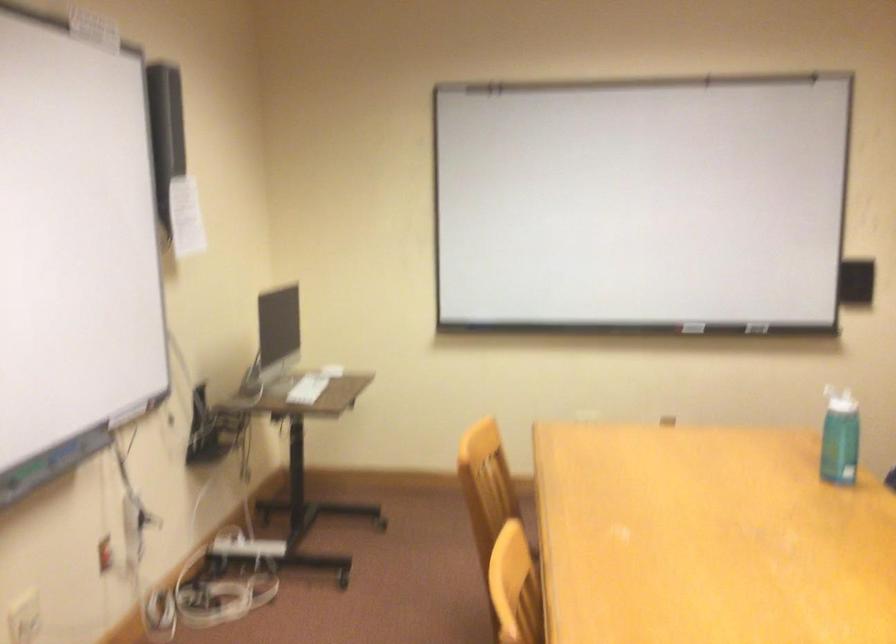
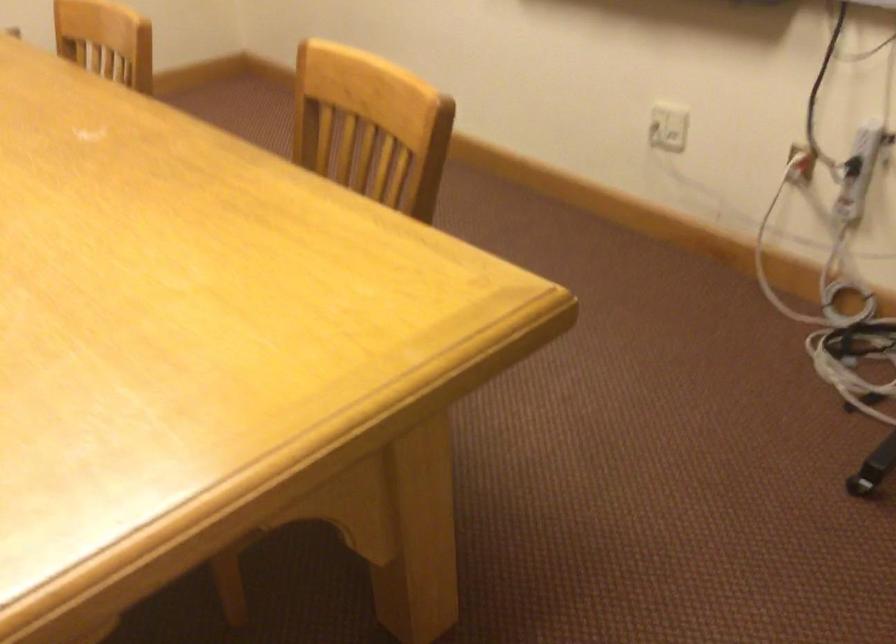
Locate, in the second image, the point that corresponds to point (122, 547) in the first image.

(800, 164)